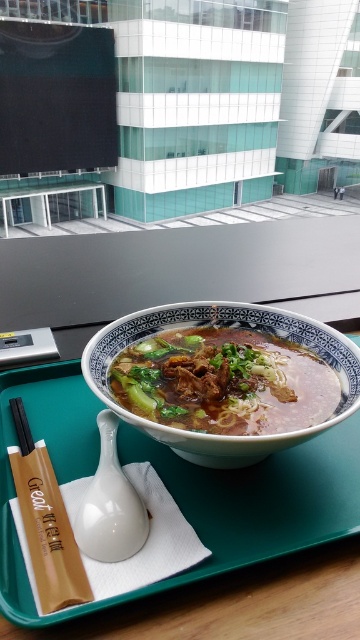
You are a food delivery person who just received a ramen order. The customer mentioned they want the noodles to be placed exactly at the center of the bowl. Based on the image, are the brown matte noodles at center positioned correctly?

The brown matte noodles at center are located at point (223, 381), which is very close to the center coordinates of the bowl. Therefore, the noodles are positioned correctly at the center of the bowl.

You are a delivery person who needs to pick up the tray from the table. The tray has a point marked at coordinates (6, 481). If your hand is 37.49 centimeters away from this point, can you safely reach it without knocking over the ramen bowl?

The point at (6, 481) is 37.49 centimeters away from the viewer. Since the hand needs to reach exactly that distance, you can safely pick up the tray by grasping near this point without disturbing the ramen bowl.

You are a food critic who needs to describe the height of the items on the teal tray. Which item is taller between the brown matte noodles at center and the black wood chopsticks at upper left?

The brown matte noodles at center is much taller than the black wood chopsticks at upper left according to the description.